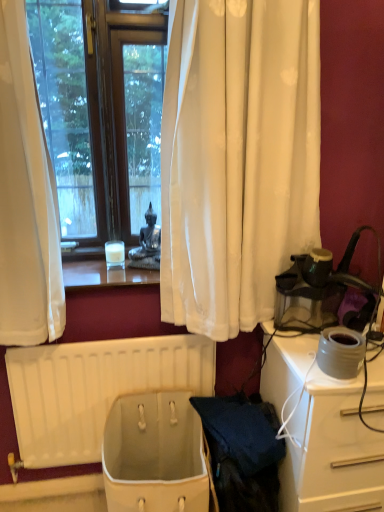
You are a GUI agent. You are given a task and a screenshot of the screen. Output one action in this format:
    pyautogui.click(x=<x>, y=<y>)
    Task: Click on the translucent glass candle at center
    The width and height of the screenshot is (384, 512).
    Given the screenshot: What is the action you would take?
    pyautogui.click(x=105, y=275)

Is point (65, 365) positioned after point (340, 338)?

Yes, it is behind point (340, 338).

Is white plastic radiator at lower center to the right of matte gray pot at right from the viewer's perspective?

In fact, white plastic radiator at lower center is to the left of matte gray pot at right.

Consider the image. Which is in front, white plastic radiator at lower center or matte gray pot at right?

matte gray pot at right is closer to the camera.

Which of these two, translucent glass candle at center or white glossy desk at right, is bigger?

white glossy desk at right is bigger.

From the picture: Between translucent glass candle at center and white glossy desk at right, which one has less height?

With less height is translucent glass candle at center.

Between translucent glass candle at center and white glossy desk at right, which one appears on the right side from the viewer's perspective?

From the viewer's perspective, white glossy desk at right appears more on the right side.

Can white glossy desk at right be found inside translucent glass candle at center?

No.

Is the position of white plastic radiator at lower center more distant than that of translucent glass candle at center?

Yes, it is behind translucent glass candle at center.

Considering the positions of objects white plastic radiator at lower center and translucent glass candle at center in the image provided, who is more to the right, white plastic radiator at lower center or translucent glass candle at center?

Positioned to the right is translucent glass candle at center.

Considering the sizes of white plastic radiator at lower center and translucent glass candle at center in the image, is white plastic radiator at lower center wider or thinner than translucent glass candle at center?

Clearly, white plastic radiator at lower center has less width compared to translucent glass candle at center.

Is white glossy desk at right bigger than white fabric basket at lower center?

Yes.

Can you tell me how much white glossy desk at right and white fabric basket at lower center differ in facing direction?

The facing directions of white glossy desk at right and white fabric basket at lower center are 1.39 degrees apart.

Can you confirm if white glossy desk at right is thinner than white fabric basket at lower center?

Incorrect, the width of white glossy desk at right is not less than that of white fabric basket at lower center.

From a real-world perspective, which is physically below, white glossy desk at right or white fabric basket at lower center?

From a 3D spatial view, white fabric basket at lower center is below.

Looking at their sizes, would you say white plastic radiator at lower center is wider or thinner than white glossy desk at right?

Clearly, white plastic radiator at lower center has less width compared to white glossy desk at right.

From the image's perspective, who appears lower, white plastic radiator at lower center or white glossy desk at right?

white glossy desk at right appears lower in the image.

Is white plastic radiator at lower center oriented towards white glossy desk at right?

No.

This screenshot has width=384, height=512. Find the location of `desk below the white plastic radiator at lower center (from a real-world perspective)`. desk below the white plastic radiator at lower center (from a real-world perspective) is located at coordinates (331, 451).

Does translucent glass candle at center have a lesser height compared to matte gray pot at right?

Correct, translucent glass candle at center is not as tall as matte gray pot at right.

Is the surface of translucent glass candle at center in direct contact with matte gray pot at right?

No, translucent glass candle at center is not in contact with matte gray pot at right.

Locate an element on the screen. The width and height of the screenshot is (384, 512). window sill on the left of the matte gray pot at right is located at coordinates (105, 275).

From the image's perspective, is translucent glass candle at center positioned above or below matte gray pot at right?

From the image's perspective, translucent glass candle at center appears above matte gray pot at right.

In terms of height, does white plastic radiator at lower center look taller or shorter compared to white fabric basket at lower center?

white plastic radiator at lower center is taller than white fabric basket at lower center.

Is white plastic radiator at lower center further to the viewer compared to white fabric basket at lower center?

That is True.

Considering the sizes of objects white plastic radiator at lower center and white fabric basket at lower center in the image provided, who is bigger, white plastic radiator at lower center or white fabric basket at lower center?

white fabric basket at lower center.

Is white fabric basket at lower center completely or partially inside white plastic radiator at lower center?

That's incorrect, white fabric basket at lower center is not inside white plastic radiator at lower center.

At what (x,y) coordinates should I click in order to perform the action: click on appliance in front of the white plastic radiator at lower center. Please return your answer as a coordinate pair (x, y). Looking at the image, I should click on (341, 352).

Where is `desk lying below the translucent glass candle at center (from the image's perspective)`? The width and height of the screenshot is (384, 512). desk lying below the translucent glass candle at center (from the image's perspective) is located at coordinates (331, 451).

When comparing their distances from matte gray pot at right, does white glossy desk at right or translucent glass candle at center seem closer?

white glossy desk at right is closer to matte gray pot at right.

Looking at the image, which one is located further to matte gray pot at right, white plastic radiator at lower center or white glossy desk at right?

Based on the image, white plastic radiator at lower center appears to be further to matte gray pot at right.

Estimate the real-world distances between objects in this image. Which object is closer to white plastic radiator at lower center, white fabric basket at lower center or white glossy desk at right?

The object closer to white plastic radiator at lower center is white fabric basket at lower center.

Estimate the real-world distances between objects in this image. Which object is closer to white plastic radiator at lower center, matte gray pot at right or translucent glass candle at center?

translucent glass candle at center is closer to white plastic radiator at lower center.

From the image, which object appears to be farther from white glossy desk at right, white plastic radiator at lower center or translucent glass candle at center?

translucent glass candle at center.

Which object lies further to the anchor point matte gray pot at right, white fabric basket at lower center or white plastic radiator at lower center?

white plastic radiator at lower center lies further to matte gray pot at right than the other object.

Which object lies nearer to the anchor point translucent glass candle at center, matte gray pot at right or white plastic radiator at lower center?

white plastic radiator at lower center.

Based on their spatial positions, is matte gray pot at right or white plastic radiator at lower center closer to white glossy desk at right?

Based on the image, matte gray pot at right appears to be nearer to white glossy desk at right.

You are a GUI agent. You are given a task and a screenshot of the screen. Output one action in this format:
    pyautogui.click(x=<x>, y=<y>)
    Task: Click on the toilet bowl between white plastic radiator at lower center and matte gray pot at right from left to right
    The image size is (384, 512).
    Given the screenshot: What is the action you would take?
    pyautogui.click(x=154, y=454)

At what (x,y) coordinates should I click in order to perform the action: click on appliance between white plastic radiator at lower center and white glossy desk at right. Please return your answer as a coordinate pair (x, y). The image size is (384, 512). Looking at the image, I should click on (341, 352).

Where is `appliance between translucent glass candle at center and white fabric basket at lower center in the vertical direction`? This screenshot has height=512, width=384. appliance between translucent glass candle at center and white fabric basket at lower center in the vertical direction is located at coordinates (341, 352).

At what (x,y) coordinates should I click in order to perform the action: click on toilet bowl between translucent glass candle at center and white glossy desk at right. Please return your answer as a coordinate pair (x, y). Looking at the image, I should click on (154, 454).